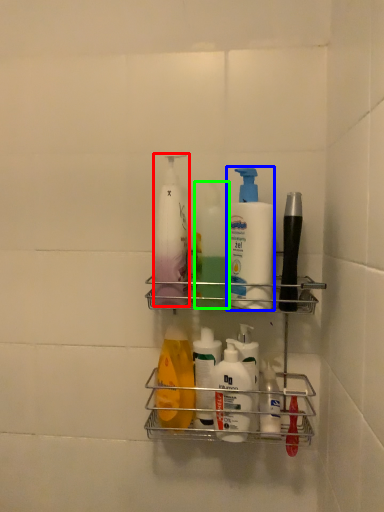
Question: Which is farther away from cleaning product (highlighted by a red box)? cleaning product (highlighted by a blue box) or cleaning product (highlighted by a green box)?

Choices:
 (A) cleaning product
 (B) cleaning product

Answer: (A)